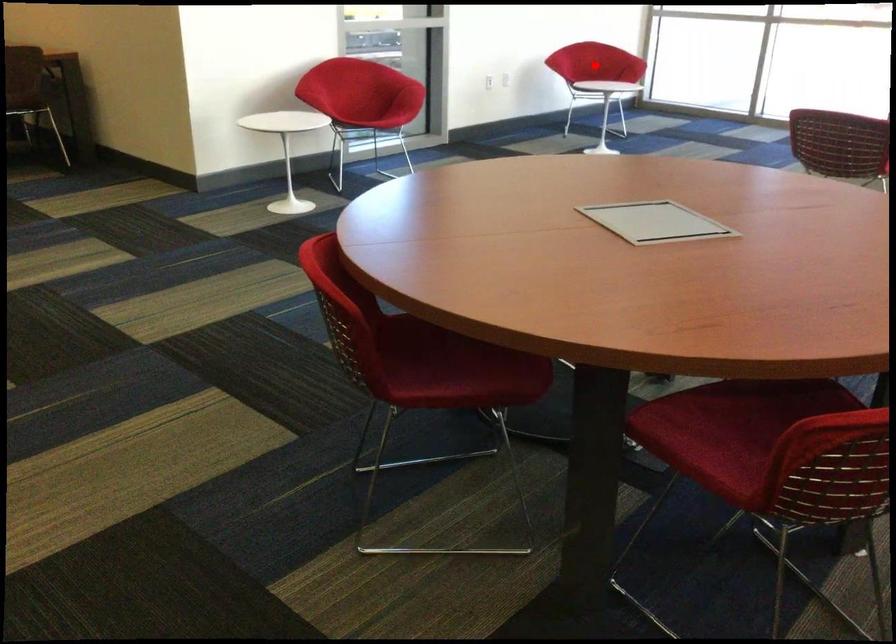
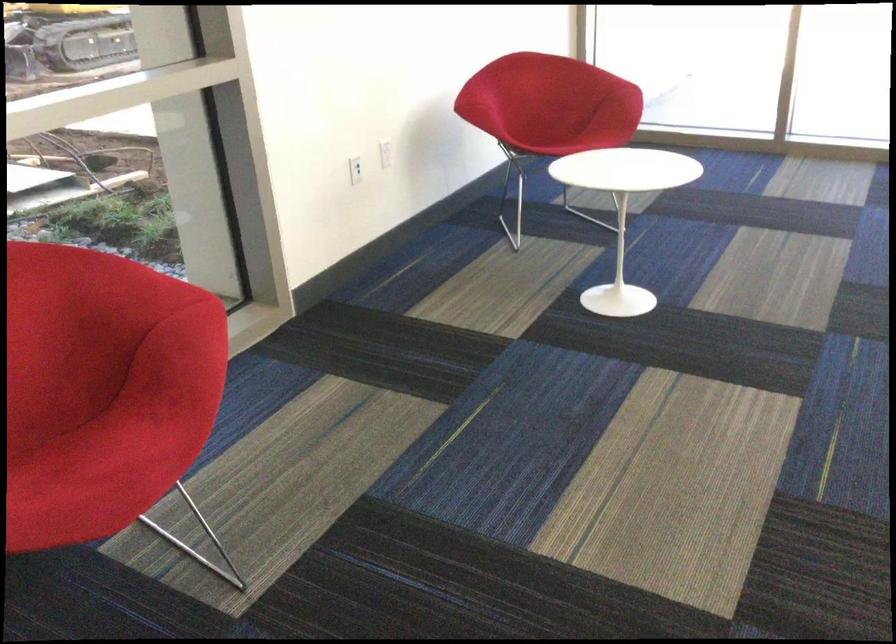
Question: I am providing you with two images of the same scene from different viewpoints. A red point is marked on the first image. Can you still see the location of the red point in image 2?

Choices:
 (A) Yes
 (B) No

Answer: (B)